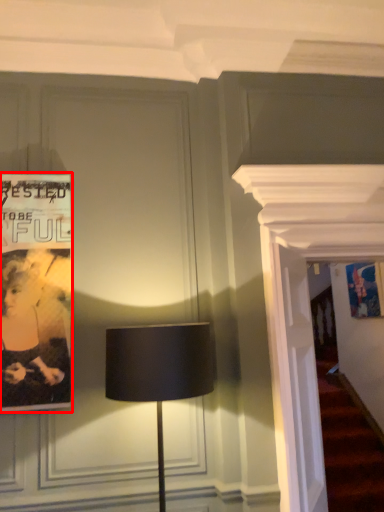
Question: From the image's perspective, what is the correct spatial relationship of poster (annotated by the red box) in relation to lamp?

Choices:
 (A) below
 (B) above

Answer: (B)